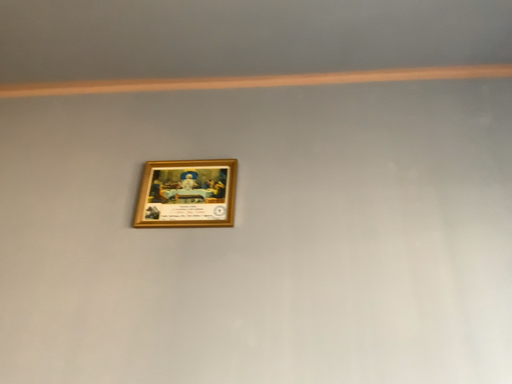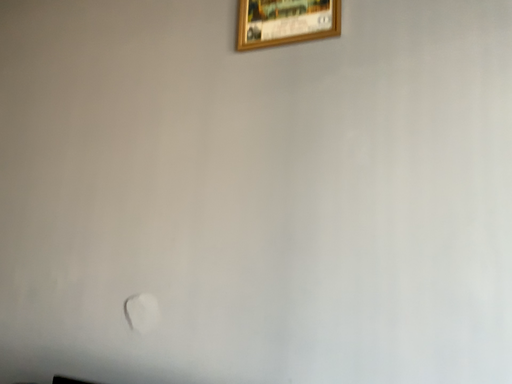
Question: Which way did the camera rotate in the video?

Choices:
 (A) rotated right
 (B) rotated left

Answer: (B)